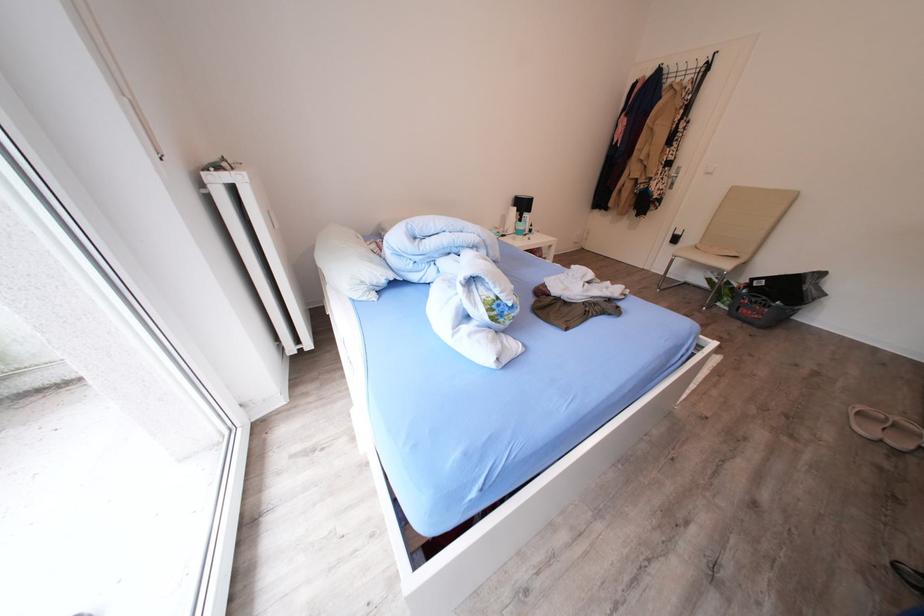
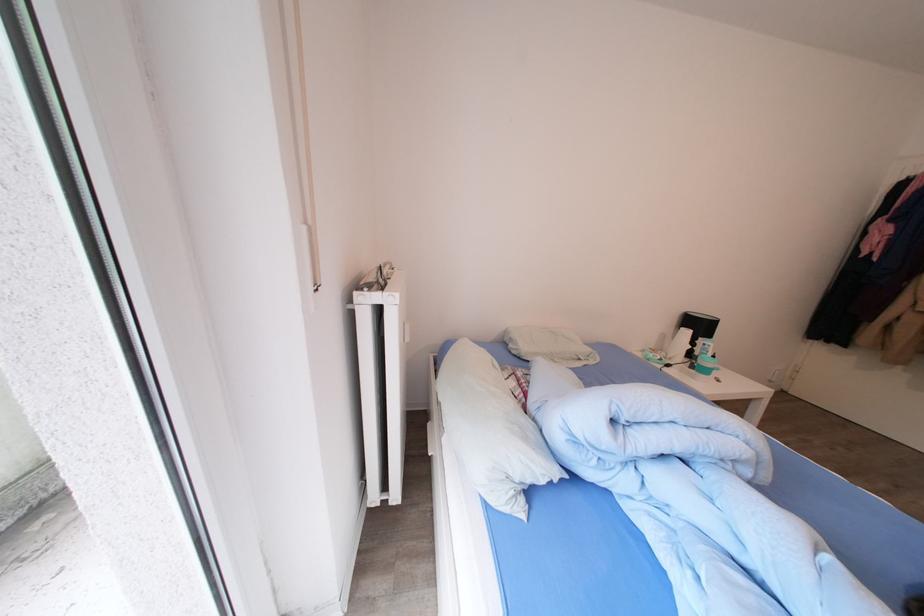
In the second image, find the point that corresponds to (x=531, y=209) in the first image.

(708, 331)